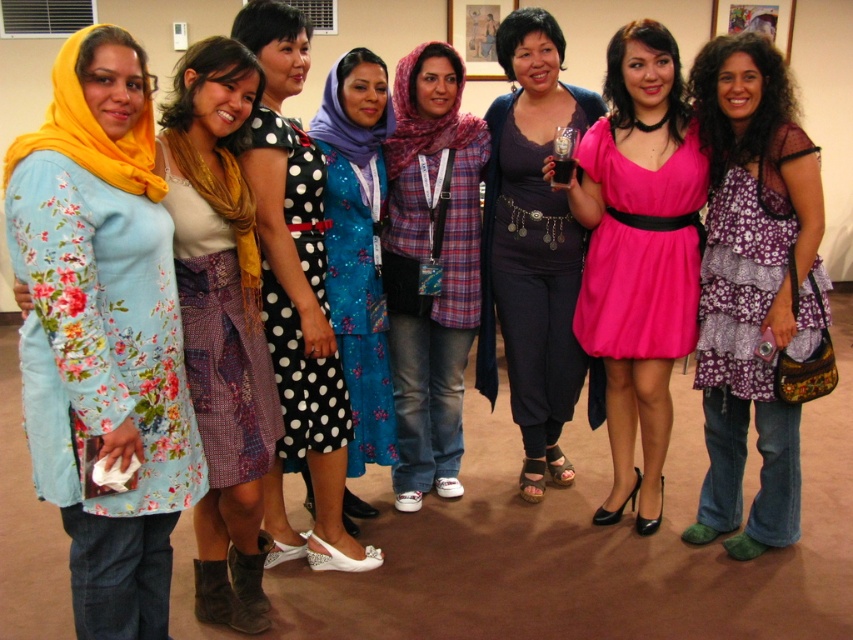
Question: Which point is farther to the camera?

Choices:
 (A) white polka dot dress at center
 (B) black polka dot dress at center

Answer: (B)

Question: Which point is farther from the camera taking this photo?

Choices:
 (A) (360, 278)
 (B) (775, 321)

Answer: (A)

Question: Which of the following is the closest to the observer?

Choices:
 (A) (51, 241)
 (B) (291, 342)
 (C) (397, 83)

Answer: (A)

Question: Is purple floral dress at center closer to the viewer compared to pink chiffon dress at center?

Choices:
 (A) no
 (B) yes

Answer: (B)

Question: Is plaid fabric headscarf at center to the right of pink chiffon dress at center from the viewer's perspective?

Choices:
 (A) no
 (B) yes

Answer: (A)

Question: Does pink chiffon dress at center appear under purple floral dress at right?

Choices:
 (A) yes
 (B) no

Answer: (B)